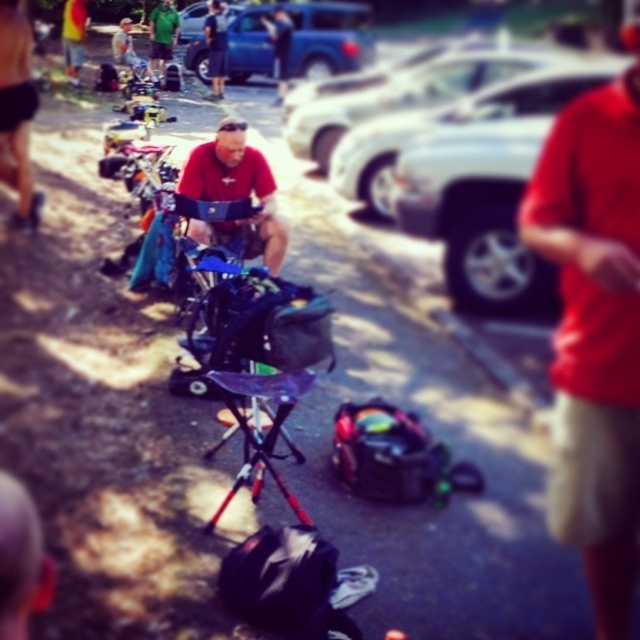
Does metallic silver car at right lie behind blue metallic truck at upper center?

No, it is in front of blue metallic truck at upper center.

Is metallic silver car at right taller than blue metallic truck at upper center?

Incorrect, metallic silver car at right's height is not larger of blue metallic truck at upper center's.

The width and height of the screenshot is (640, 640). What are the coordinates of `metallic silver car at right` in the screenshot? It's located at (486, 188).

Does red matte shirt at right appear on the right side of metallic silver folding chair at center?

Correct, you'll find red matte shirt at right to the right of metallic silver folding chair at center.

Measure the distance between red matte shirt at right and camera.

red matte shirt at right is 6.78 feet away from camera.

Is point (618, 481) less distant than point (275, 384)?

Yes, it is.

Identify the location of red matte shirt at right. Image resolution: width=640 pixels, height=640 pixels. (595, 330).

Does metallic silver car at right come in front of matte red shirt at center?

No, metallic silver car at right is further to the viewer.

Does metallic silver car at right come behind matte red shirt at center?

Yes, it is.

Is point (515, 211) behind point (257, 216)?

Yes, point (515, 211) is farther from viewer.

The width and height of the screenshot is (640, 640). What are the coordinates of `metallic silver car at right` in the screenshot? It's located at (486, 188).